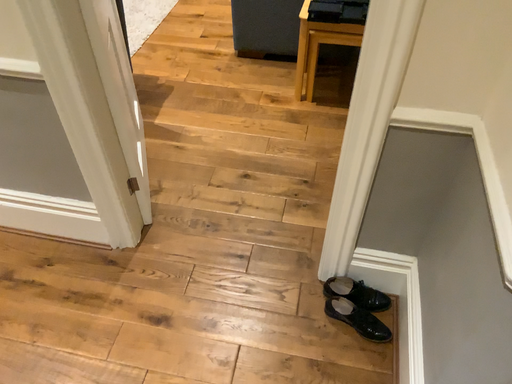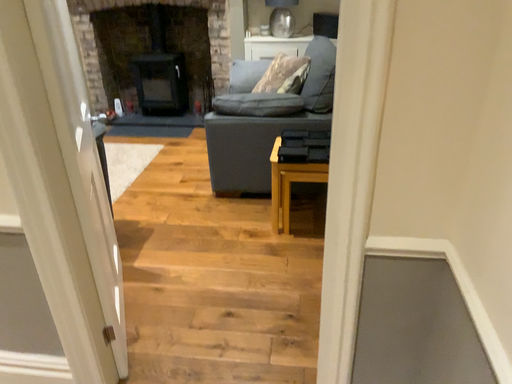
Question: Which way did the camera rotate in the video?

Choices:
 (A) rotated upward
 (B) rotated downward

Answer: (A)